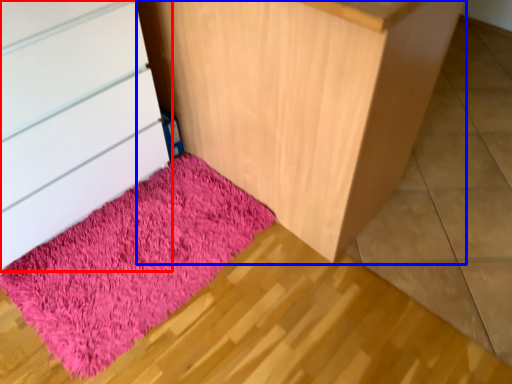
Question: Which object appears closest to the camera in this image, chest of drawers (highlighted by a red box) or furniture (highlighted by a blue box)?

Choices:
 (A) chest of drawers
 (B) furniture

Answer: (B)